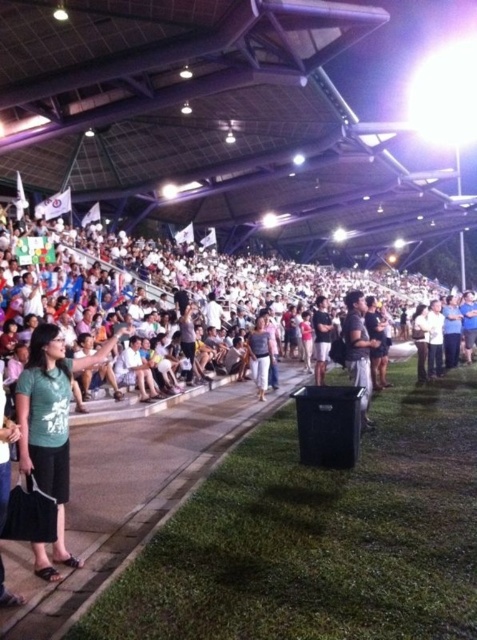
Question: Which point is closer to the camera taking this photo?

Choices:
 (A) (83, 369)
 (B) (338, 292)
 (C) (348, 296)

Answer: (A)

Question: Which object is the closest to the black fabric shirt at center?

Choices:
 (A) white fabric crowd at upper center
 (B) light brown fabric pants at center

Answer: (B)

Question: Does black fabric shirt at center have a smaller size compared to light brown fabric pants at center?

Choices:
 (A) yes
 (B) no

Answer: (B)

Question: In this image, where is black fabric shirt at center located relative to light brown fabric pants at center?

Choices:
 (A) above
 (B) below

Answer: (A)

Question: Among these objects, which one is farthest from the camera?

Choices:
 (A) white fabric crowd at upper center
 (B) dark gray fabric shirt at center
 (C) green matte shirt at center
 (D) black fabric shirt at center

Answer: (B)

Question: Does white fabric crowd at upper center have a lesser width compared to light brown fabric pants at center?

Choices:
 (A) no
 (B) yes

Answer: (A)